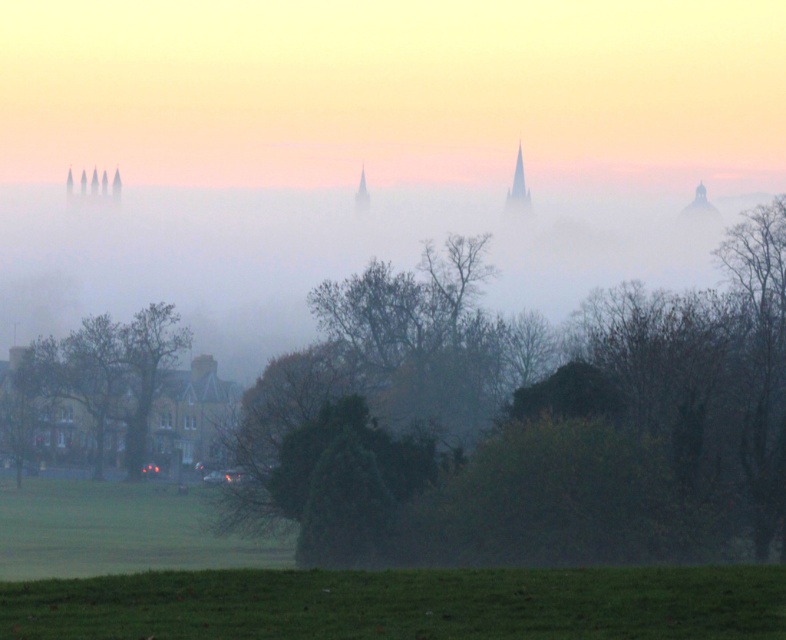
You are an artist planning to paint this landscape. You want to emphasize the green leafy tree at center and the foggy misty atmosphere at center. Which object should you paint first to ensure proper layering according to their sizes?

The green leafy tree at center has a smaller size compared to the foggy misty atmosphere at center, so you should paint the foggy misty atmosphere at center first as it is larger and forms the background layer, then add the smaller green leafy tree at center on top for proper depth.

Consider the image. You are standing in the misty landscape and want to move from your current position to the point at the lower right corner of the image. You see two points marked in the scene, point (660, 362) and point (358, 200). Which point should you head towards if you want to reach the lower right corner first?

Point (660, 362) is in front of point (358, 200), so you should head towards point (660, 362) to reach the lower right corner first.